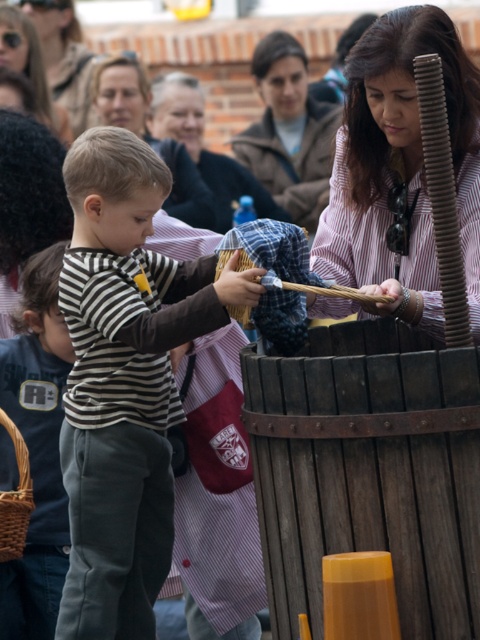
Is striped shirt at upper center wider than wooden stick at center?

Correct, the width of striped shirt at upper center exceeds that of wooden stick at center.

Who is positioned more to the right, striped shirt at upper center or wooden stick at center?

wooden stick at center is more to the right.

Which is in front, point (170, 118) or point (243, 312)?

Point (243, 312) is in front.

Where is `striped shirt at upper center`? The image size is (480, 640). striped shirt at upper center is located at coordinates (204, 148).

In the scene shown: Who is more forward, (276, 109) or (226, 250)?

Point (226, 250) is more forward.

Between matte brown shirt at center and wooden stick at center, which one is positioned higher?

matte brown shirt at center is higher up.

The image size is (480, 640). Identify the location of matte brown shirt at center. (289, 131).

You are a GUI agent. You are given a task and a screenshot of the screen. Output one action in this format:
    pyautogui.click(x=<x>, y=<y>)
    Task: Click on the matte pink shirt at upper center
    The width and height of the screenshot is (480, 640).
    Given the screenshot: What is the action you would take?
    pyautogui.click(x=148, y=134)

Can you confirm if matte pink shirt at upper center is positioned below brown woven basket at lower left?

No.

Is point (107, 99) positioned behind point (25, 456)?

Yes, point (107, 99) is farther from viewer.

In order to click on matte pink shirt at upper center in this screenshot , I will do `click(148, 134)`.